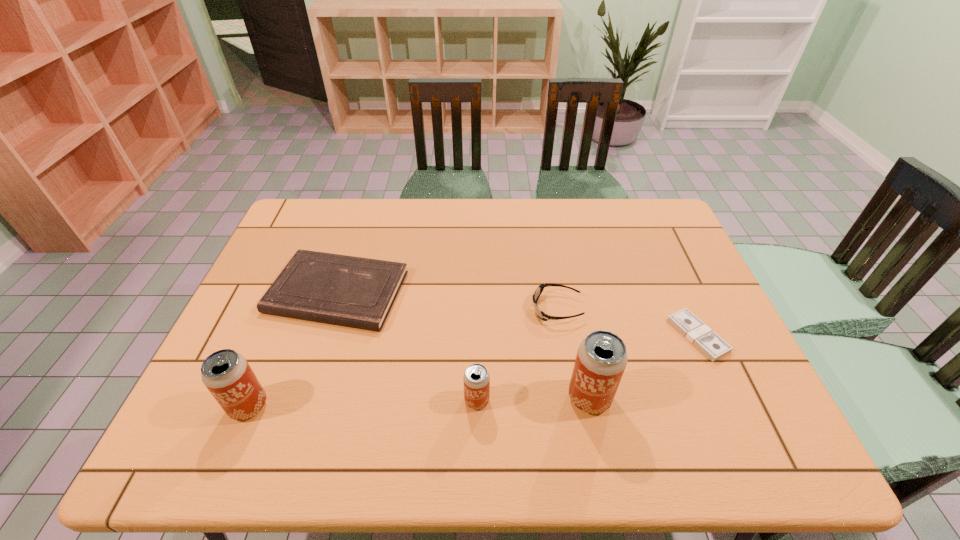
Find the location of a particular element. object that is at the near left corner is located at coordinates (227, 375).

The image size is (960, 540). In the image, there is a desktop. In order to click on vacant space at the far edge in this screenshot , I will do `click(352, 210)`.

In the image, there is a desktop. Where is `vacant space at the near edge`? The width and height of the screenshot is (960, 540). vacant space at the near edge is located at coordinates (562, 384).

In the image, there is a desktop. At what (x,y) coordinates should I click in order to perform the action: click on vacant space at the far left corner. Please return your answer as a coordinate pair (x, y). This screenshot has width=960, height=540. Looking at the image, I should click on (317, 200).

Where is `unoccupied position between the dollar and the paperback book`? unoccupied position between the dollar and the paperback book is located at coordinates (x=517, y=314).

Find the location of `free space between the paperback book and the rightmost beer can`. free space between the paperback book and the rightmost beer can is located at coordinates (464, 345).

The width and height of the screenshot is (960, 540). In order to click on free point between the fourth object from right to left and the rightmost beer can in this screenshot , I will do `click(533, 399)`.

This screenshot has height=540, width=960. What are the coordinates of `vacant space that is in between the shortest beer can and the sunglasses` in the screenshot? It's located at (516, 355).

I want to click on empty space between the paperback book and the rightmost beer can, so click(x=464, y=345).

The height and width of the screenshot is (540, 960). What are the coordinates of `free area in between the sunglasses and the rightmost beer can` in the screenshot? It's located at (573, 353).